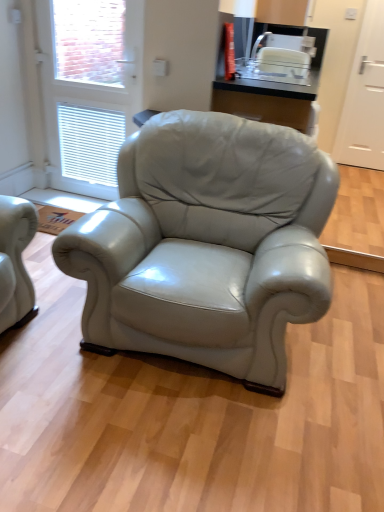
Locate an element on the screen. white plastic toaster at upper center is located at coordinates (283, 55).

Image resolution: width=384 pixels, height=512 pixels. I want to click on white matte door at right, acting as the 2th screen door starting from the left, so (364, 97).

Considering the relative sizes of white plastic toaster at upper center and white matte door at right, the 1th screen door from the right, in the image provided, is white plastic toaster at upper center smaller than white matte door at right, the 1th screen door from the right,?

Indeed, white plastic toaster at upper center has a smaller size compared to white matte door at right, the 1th screen door from the right.

Is white plastic toaster at upper center facing towards white matte door at right, positioned as the first screen door in back-to-front order?

No, white plastic toaster at upper center does not turn towards white matte door at right, positioned as the first screen door in back-to-front order.

Which is in front, point (295, 37) or point (382, 53)?

The point (295, 37) is closer to the camera.

From the image's perspective, is white plastic toaster at upper center under white matte door at right, positioned as the first screen door in back-to-front order?

Yes, from the image's perspective, white plastic toaster at upper center is below white matte door at right, positioned as the first screen door in back-to-front order.

Is white matte door at right, the second screen door viewed from the front, facing away from white plastic toaster at upper center?

white matte door at right, the second screen door viewed from the front, does not have its back to white plastic toaster at upper center.

Is white matte door at right, positioned as the first screen door in back-to-front order, bigger or smaller than white plastic toaster at upper center?

Considering their sizes, white matte door at right, positioned as the first screen door in back-to-front order, takes up more space than white plastic toaster at upper center.

Is white matte door at right, positioned as the first screen door in back-to-front order, inside the boundaries of white plastic toaster at upper center, or outside?

white matte door at right, positioned as the first screen door in back-to-front order, is outside white plastic toaster at upper center.

Which of these two, white glossy screen door at upper left, the first screen door when ordered from left to right, or white matte door at right, the second screen door viewed from the front, is smaller?

white matte door at right, the second screen door viewed from the front, is smaller.

From the image's perspective, which object appears higher, white glossy screen door at upper left, the first screen door when ordered from left to right, or white matte door at right, the second screen door viewed from the front?

white matte door at right, the second screen door viewed from the front, appears higher in the image.

This screenshot has height=512, width=384. I want to click on screen door that is below the white matte door at right, the second screen door viewed from the front (from the image's perspective), so click(89, 88).

Which object is wider, white glossy screen door at upper left, the first screen door when ordered from left to right, or white matte door at right, positioned as the first screen door in back-to-front order?

Wider between the two is white glossy screen door at upper left, the first screen door when ordered from left to right.

Would you say white matte door at right, acting as the 2th screen door starting from the left, is inside or outside white glossy screen door at upper left, the 2th screen door positioned from the back?

white matte door at right, acting as the 2th screen door starting from the left, is not enclosed by white glossy screen door at upper left, the 2th screen door positioned from the back.

Based on the photo, considering the positions of objects white matte door at right, positioned as the first screen door in back-to-front order, and white glossy screen door at upper left, the first screen door when ordered from left to right, in the image provided, who is behind, white matte door at right, positioned as the first screen door in back-to-front order, or white glossy screen door at upper left, the first screen door when ordered from left to right,?

white matte door at right, positioned as the first screen door in back-to-front order.

Is there a large distance between white matte door at right, the 1th screen door from the right, and white glossy screen door at upper left, which appears as the 1th screen door when viewed from the front?

Yes, white matte door at right, the 1th screen door from the right, is far from white glossy screen door at upper left, which appears as the 1th screen door when viewed from the front.

Which of these two, white matte door at right, the 1th screen door from the right, or white glossy screen door at upper left, placed as the 2th screen door when sorted from right to left, is thinner?

white matte door at right, the 1th screen door from the right.

Which object is closer to the camera taking this photo, white glossy screen door at upper left, placed as the 2th screen door when sorted from right to left, or white plastic toaster at upper center?

Positioned in front is white glossy screen door at upper left, placed as the 2th screen door when sorted from right to left.

Is white glossy screen door at upper left, the 2th screen door positioned from the back, facing towards white plastic toaster at upper center?

No, white glossy screen door at upper left, the 2th screen door positioned from the back, is not oriented towards white plastic toaster at upper center.

Looking at this image, from a real-world perspective, is white glossy screen door at upper left, which appears as the 1th screen door when viewed from the front, located beneath white plastic toaster at upper center?

Indeed, from a real-world perspective, white glossy screen door at upper left, which appears as the 1th screen door when viewed from the front, is positioned beneath white plastic toaster at upper center.

Are white plastic toaster at upper center and white glossy screen door at upper left, the 2th screen door positioned from the back, far apart?

Absolutely, white plastic toaster at upper center is distant from white glossy screen door at upper left, the 2th screen door positioned from the back.

Is white plastic toaster at upper center at the left side of white glossy screen door at upper left, the 2th screen door positioned from the back?

In fact, white plastic toaster at upper center is to the right of white glossy screen door at upper left, the 2th screen door positioned from the back.

Relative to white glossy screen door at upper left, the 2th screen door positioned from the back, is white plastic toaster at upper center in front or behind?

white plastic toaster at upper center is positioned farther from the viewer than white glossy screen door at upper left, the 2th screen door positioned from the back.

Locate an element on the screen. The image size is (384, 512). appliance above the white matte door at right, the second screen door viewed from the front (from a real-world perspective) is located at coordinates (283, 55).

Locate an element on the screen. The width and height of the screenshot is (384, 512). appliance in front of the white matte door at right, the second screen door viewed from the front is located at coordinates (283, 55).

From the image, which object appears to be nearer to white glossy screen door at upper left, the 2th screen door positioned from the back, white matte door at right, positioned as the first screen door in back-to-front order, or white plastic toaster at upper center?

The object closer to white glossy screen door at upper left, the 2th screen door positioned from the back, is white plastic toaster at upper center.

Considering their positions, is white plastic toaster at upper center positioned closer to white matte door at right, positioned as the first screen door in back-to-front order, than white glossy screen door at upper left, the 2th screen door positioned from the back?

Among the two, white plastic toaster at upper center is located nearer to white matte door at right, positioned as the first screen door in back-to-front order.

Considering their positions, is white plastic toaster at upper center positioned further to white glossy screen door at upper left, which appears as the 1th screen door when viewed from the front, than white matte door at right, acting as the 2th screen door starting from the left?

The object further to white glossy screen door at upper left, which appears as the 1th screen door when viewed from the front, is white matte door at right, acting as the 2th screen door starting from the left.

Looking at the image, which one is located further to white matte door at right, positioned as the first screen door in back-to-front order, white glossy screen door at upper left, the first screen door when ordered from left to right, or white plastic toaster at upper center?

white glossy screen door at upper left, the first screen door when ordered from left to right, lies further to white matte door at right, positioned as the first screen door in back-to-front order, than the other object.

Estimate the real-world distances between objects in this image. Which object is closer to white plastic toaster at upper center, white matte door at right, the second screen door viewed from the front, or white glossy screen door at upper left, placed as the 2th screen door when sorted from right to left?

The object closer to white plastic toaster at upper center is white matte door at right, the second screen door viewed from the front.

When comparing their distances from white plastic toaster at upper center, does white glossy screen door at upper left, which appears as the 1th screen door when viewed from the front, or white matte door at right, the second screen door viewed from the front, seem closer?

white matte door at right, the second screen door viewed from the front, is positioned closer to the anchor white plastic toaster at upper center.

This screenshot has width=384, height=512. Identify the location of appliance located between white glossy screen door at upper left, the 2th screen door positioned from the back, and white matte door at right, the second screen door viewed from the front, in the left-right direction. (283, 55).